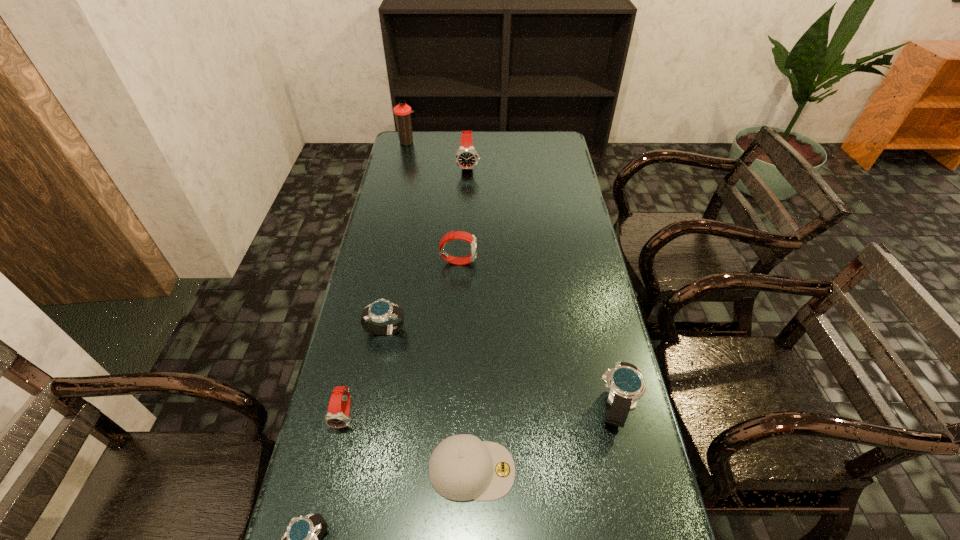
I want to click on free region located on the front-facing side of the second nearest object, so click(635, 470).

Where is `thermos bottle that is positioned at the far edge`? thermos bottle that is positioned at the far edge is located at coordinates (402, 111).

The image size is (960, 540). I want to click on watch that is at the far edge, so click(466, 158).

Identify the location of thermos bottle located at the left edge. Image resolution: width=960 pixels, height=540 pixels. 402,111.

The image size is (960, 540). Find the location of `object that is at the right edge`. object that is at the right edge is located at coordinates (626, 386).

In order to click on object located at the far left corner in this screenshot , I will do `click(402, 111)`.

Where is `free space at the far edge of the desktop`? This screenshot has height=540, width=960. free space at the far edge of the desktop is located at coordinates (451, 132).

Find the location of a particular element. The width and height of the screenshot is (960, 540). free space at the left edge of the desktop is located at coordinates (379, 199).

At what (x,y) coordinates should I click in order to perform the action: click on free location at the right edge of the desktop. Please return your answer as a coordinate pair (x, y). This screenshot has height=540, width=960. Looking at the image, I should click on (567, 356).

The width and height of the screenshot is (960, 540). Identify the location of free space between the tallest watch and the farthest object. (438, 154).